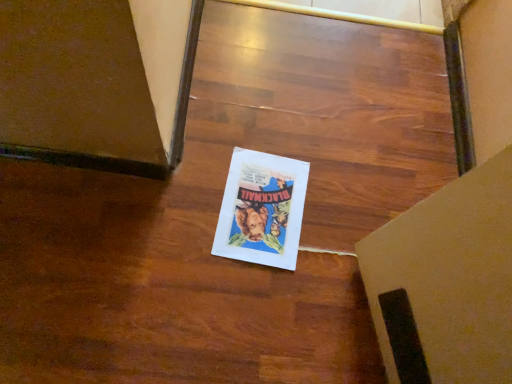
Locate an element on the screen. vacant area that lies in front of matte paper poster at center is located at coordinates (238, 294).